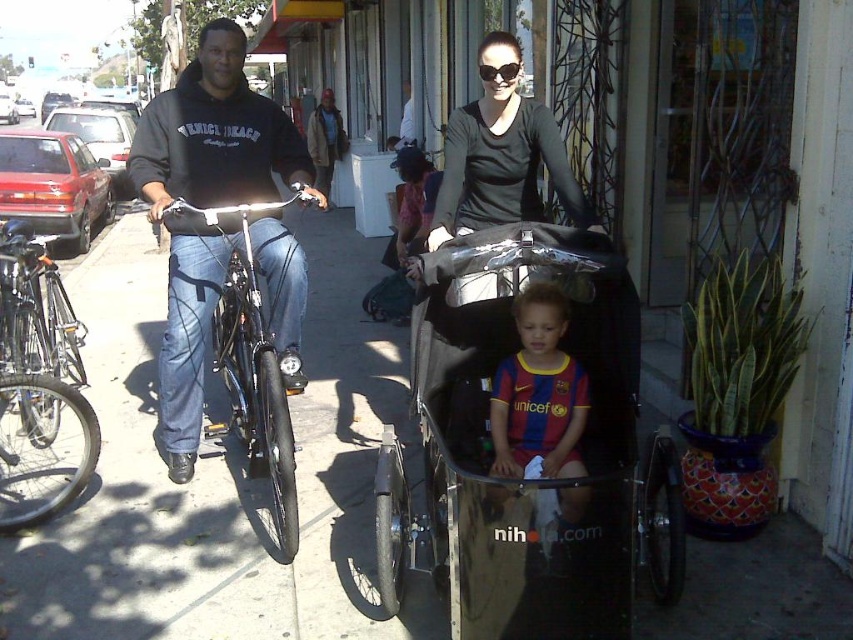
Question: Is metallic silver baby carriage at center closer to the viewer compared to silver metallic bicycle at left?

Choices:
 (A) no
 (B) yes

Answer: (B)

Question: Which point is closer to the camera?

Choices:
 (A) black matte shirt at center
 (B) metallic silver baby carriage at center
 (C) smooth concrete sidewalk at center

Answer: (B)

Question: Which point is closer to the camera taking this photo?

Choices:
 (A) (57, 288)
 (B) (538, 372)
 (C) (223, 211)

Answer: (B)

Question: Does metallic silver baby carriage at center appear over silver metallic bicycle at left?

Choices:
 (A) no
 (B) yes

Answer: (A)

Question: Which object is closer to the camera taking this photo?

Choices:
 (A) blue and red jersey at center
 (B) shiny black bicycle at left
 (C) black matte shirt at center
 (D) silver metallic bicycle at left

Answer: (A)

Question: Can you confirm if smooth concrete sidewalk at center is positioned to the left of black matte shirt at center?

Choices:
 (A) no
 (B) yes

Answer: (B)